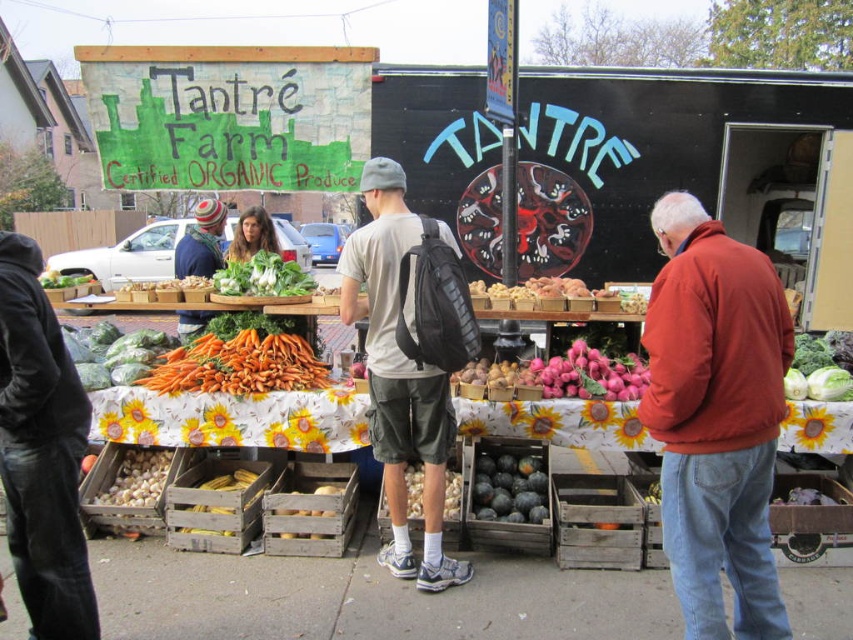
Question: Which point is closer to the camera?

Choices:
 (A) (196, 532)
 (B) (805, 376)
 (C) (636, 387)
 (D) (374, 112)

Answer: (A)

Question: Based on their relative distances, which object is nearer to the pink matte radish at center?

Choices:
 (A) orange cotton jacket at right
 (B) wooden crate of corn at center

Answer: (A)

Question: Does white matte garlic at lower left appear under smooth brown potato at center?

Choices:
 (A) yes
 (B) no

Answer: (A)

Question: Among these objects, which one is farthest from the camera?

Choices:
 (A) green leafy vegetables at lower left
 (B) wooden crate of corn at center
 (C) dark gray hoodie at left

Answer: (A)

Question: Considering the relative positions of green leafy vegetables at lower left and smooth wooden crate of potatoes at center in the image provided, where is green leafy vegetables at lower left located with respect to smooth wooden crate of potatoes at center?

Choices:
 (A) left
 (B) right

Answer: (A)

Question: Does orange matte carrots at center have a smaller size compared to smooth brown potato at center?

Choices:
 (A) yes
 (B) no

Answer: (B)